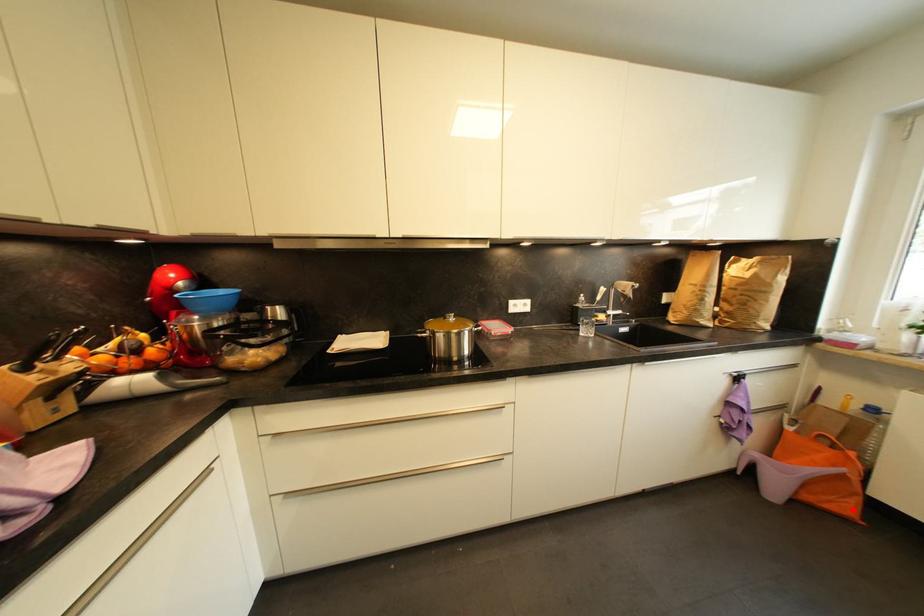
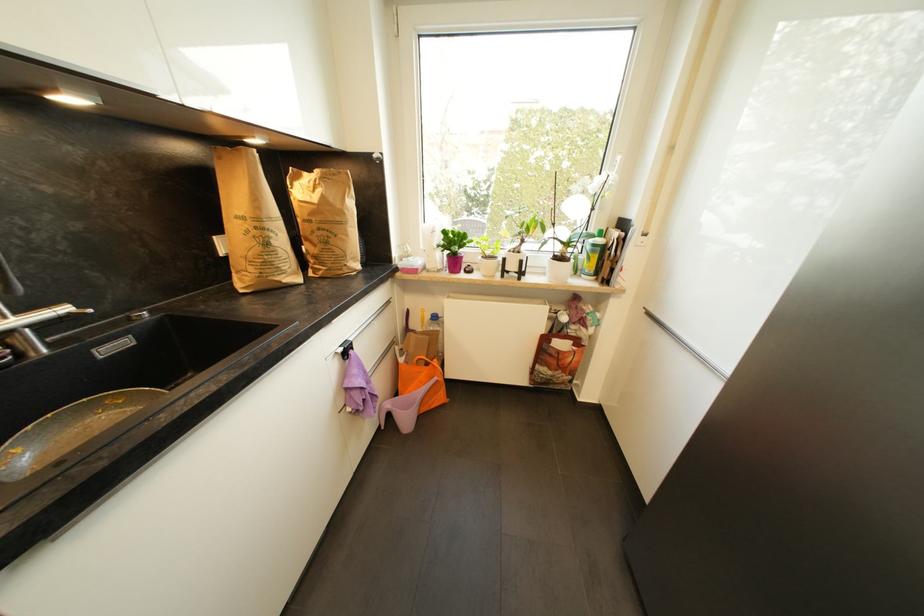
Find the pixel in the second image that matches the highlighted location in the first image.

(445, 399)